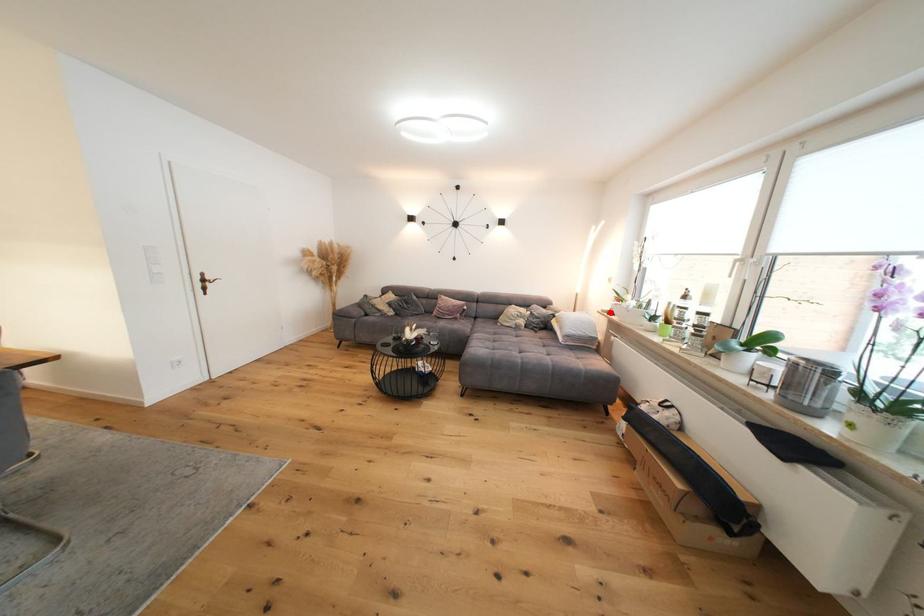
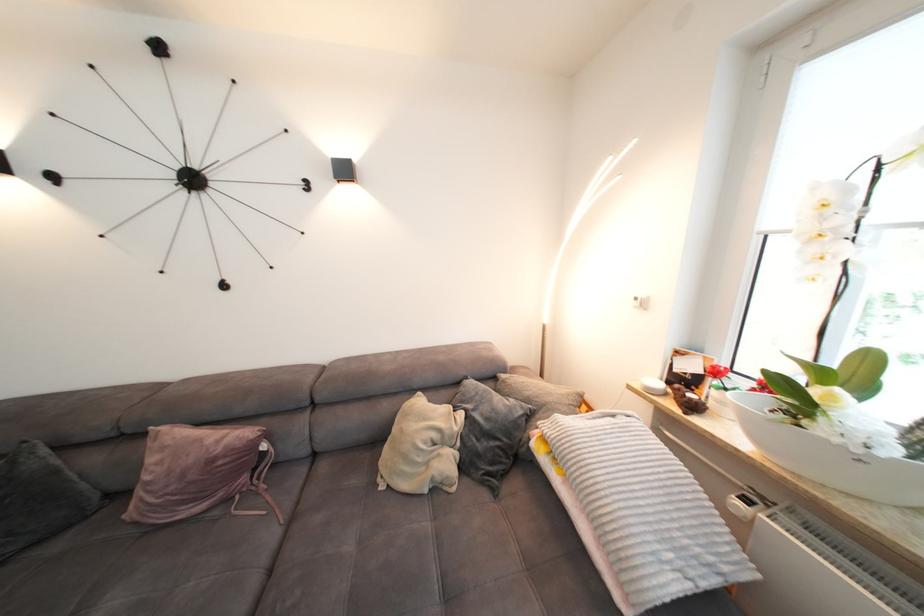
Question: I am providing you with two images of the same scene from different viewpoints. In image1, a red point is highlighted. Considering the same 3D point in image2, which of the following is correct?

Choices:
 (A) It is closer
 (B) It is farther

Answer: (B)